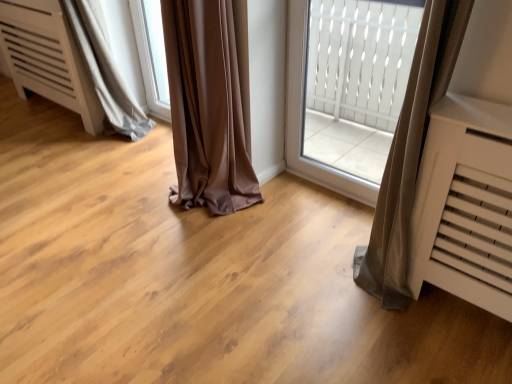
Where is `transparent glass window at center`? This screenshot has width=512, height=384. transparent glass window at center is located at coordinates (152, 55).

The height and width of the screenshot is (384, 512). I want to click on gray satin curtain at lower left, so click(x=106, y=75).

Can you confirm if transparent glass window at center is taller than gray satin curtain at lower left?

In fact, transparent glass window at center may be shorter than gray satin curtain at lower left.

Which is closer to the camera, (159, 6) or (104, 81)?

Clearly, point (159, 6) is more distant from the camera than point (104, 81).

Considering their positions, is transparent glass window at center located in front of or behind gray satin curtain at lower left?

transparent glass window at center is behind gray satin curtain at lower left.

Is transparent glass window at center oriented towards gray satin curtain at lower left?

Yes, transparent glass window at center is oriented towards gray satin curtain at lower left.

Based on their positions, is gray satin curtain at lower left located to the left or right of transparent glass window at center?

In the image, gray satin curtain at lower left appears on the left side of transparent glass window at center.

Considering the sizes of gray satin curtain at lower left and transparent glass window at center in the image, is gray satin curtain at lower left taller or shorter than transparent glass window at center?

gray satin curtain at lower left is taller than transparent glass window at center.

From a real-world perspective, is gray satin curtain at lower left below transparent glass window at center?

No, from a real-world perspective, gray satin curtain at lower left is not below transparent glass window at center.

Can you confirm if transparent glass window at center is bigger than white textured glass at center?

Incorrect, transparent glass window at center is not larger than white textured glass at center.

From the image's perspective, which is below, transparent glass window at center or white textured glass at center?

white textured glass at center, from the image's perspective.

Considering the positions of points (143, 41) and (326, 4), is point (143, 41) closer to camera compared to point (326, 4)?

That is False.

Is gray satin curtain at lower left bigger or smaller than white textured glass at center?

Considering their sizes, gray satin curtain at lower left takes up more space than white textured glass at center.

From a real-world perspective, between gray satin curtain at lower left and white textured glass at center, who is vertically higher?

white textured glass at center, from a real-world perspective.

Is gray satin curtain at lower left positioned with its back to white textured glass at center?

gray satin curtain at lower left does not have its back to white textured glass at center.

Is gray satin curtain at lower left to the left of white textured glass at center from the viewer's perspective?

Yes, gray satin curtain at lower left is to the left of white textured glass at center.

Does white textured glass at center have a larger size compared to gray satin curtain at lower left?

No, white textured glass at center is not bigger than gray satin curtain at lower left.

In the image, is white textured glass at center positioned in front of or behind gray satin curtain at lower left?

In the image, white textured glass at center appears in front of gray satin curtain at lower left.

The height and width of the screenshot is (384, 512). I want to click on curtain behind the white textured glass at center, so click(x=106, y=75).

Which of these two, white textured glass at center or gray satin curtain at lower left, stands taller?

white textured glass at center.

From the image's perspective, which one is positioned higher, white textured glass at center or transparent glass window at center?

transparent glass window at center, from the image's perspective.

Is white textured glass at center positioned with its back to transparent glass window at center?

No, white textured glass at center's orientation is not away from transparent glass window at center.

Between white textured glass at center and transparent glass window at center, which one has smaller size?

With smaller size is transparent glass window at center.

The height and width of the screenshot is (384, 512). In the image, there is a gray satin curtain at lower left. Find the location of `window below it (from a real-world perspective)`. window below it (from a real-world perspective) is located at coordinates (152, 55).

Image resolution: width=512 pixels, height=384 pixels. Find the location of `curtain that appears on the left of transparent glass window at center`. curtain that appears on the left of transparent glass window at center is located at coordinates pyautogui.click(x=106, y=75).

Which object lies nearer to the anchor point white textured glass at center, gray satin curtain at lower left or transparent glass window at center?

The object closer to white textured glass at center is transparent glass window at center.

Looking at the image, which one is located further to white textured glass at center, transparent glass window at center or gray satin curtain at lower left?

Based on the image, gray satin curtain at lower left appears to be further to white textured glass at center.

When comparing their distances from gray satin curtain at lower left, does transparent glass window at center or white textured glass at center seem further?

white textured glass at center.

Based on their spatial positions, is gray satin curtain at lower left or white textured glass at center closer to transparent glass window at center?

The object closer to transparent glass window at center is gray satin curtain at lower left.

Looking at the image, which one is located further to gray satin curtain at lower left, white textured glass at center or transparent glass window at center?

white textured glass at center.

Estimate the real-world distances between objects in this image. Which object is closer to transparent glass window at center, white textured glass at center or gray satin curtain at lower left?

The object closer to transparent glass window at center is gray satin curtain at lower left.

Identify the location of window located between gray satin curtain at lower left and white textured glass at center in the left-right direction. (152, 55).